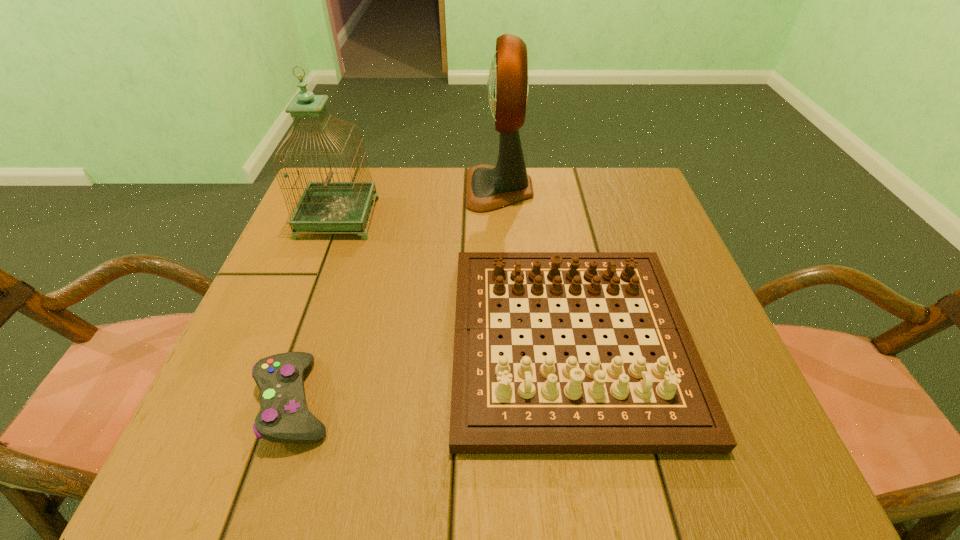
Locate an element on the screen. The height and width of the screenshot is (540, 960). fan is located at coordinates (488, 187).

This screenshot has width=960, height=540. Identify the location of birdcage. (324, 206).

Where is `gameboard`? Image resolution: width=960 pixels, height=540 pixels. gameboard is located at coordinates (555, 404).

This screenshot has height=540, width=960. What are the coordinates of `control` in the screenshot? It's located at click(x=284, y=417).

Where is `blank space located on the front-facing side of the fan`? This screenshot has height=540, width=960. blank space located on the front-facing side of the fan is located at coordinates (435, 189).

Locate an element on the screen. This screenshot has width=960, height=540. vacant space situated 0.360m on the front-facing side of the fan is located at coordinates (326, 189).

Where is `vacant area situated 0.280m on the front-facing side of the fan`? This screenshot has width=960, height=540. vacant area situated 0.280m on the front-facing side of the fan is located at coordinates (358, 189).

The image size is (960, 540). I want to click on vacant space situated 0.080m at the door of the birdcage, so click(x=407, y=218).

At what (x,y) coordinates should I click in order to perform the action: click on blank area located on the right of the shortest object. Please return your answer as a coordinate pair (x, y). Looking at the image, I should click on (423, 401).

You are a GUI agent. You are given a task and a screenshot of the screen. Output one action in this format:
    pyautogui.click(x=<x>, y=<y>)
    Task: Click on the fan that is positioned at the far edge
    
    Given the screenshot: What is the action you would take?
    pyautogui.click(x=488, y=187)